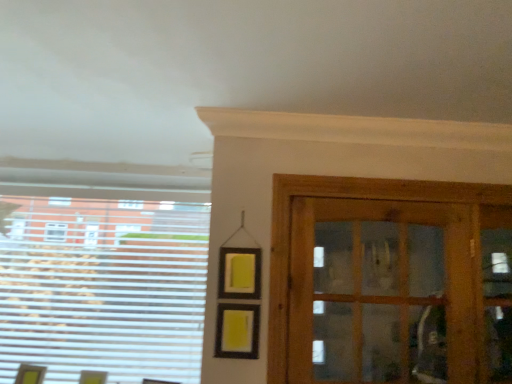
Question: Is white plastic blinds at left positioned far away from wooden cabinet at right?

Choices:
 (A) yes
 (B) no

Answer: (A)

Question: Considering the relative sizes of white plastic blinds at left and wooden cabinet at right in the image provided, is white plastic blinds at left smaller than wooden cabinet at right?

Choices:
 (A) no
 (B) yes

Answer: (B)

Question: Is white plastic blinds at left further to camera compared to wooden cabinet at right?

Choices:
 (A) no
 (B) yes

Answer: (B)

Question: From a real-world perspective, is white plastic blinds at left positioned under wooden cabinet at right based on gravity?

Choices:
 (A) yes
 (B) no

Answer: (A)

Question: Could you tell me if white plastic blinds at left is facing wooden cabinet at right?

Choices:
 (A) yes
 (B) no

Answer: (B)

Question: Is white plastic blinds at left wider than wooden cabinet at right?

Choices:
 (A) yes
 (B) no

Answer: (B)

Question: From the image's perspective, would you say wooden cabinet at right is shown under white plastic blinds at left?

Choices:
 (A) no
 (B) yes

Answer: (A)

Question: Does wooden cabinet at right contain white plastic blinds at left?

Choices:
 (A) yes
 (B) no

Answer: (B)

Question: From a real-world perspective, is wooden cabinet at right physically above white plastic blinds at left?

Choices:
 (A) no
 (B) yes

Answer: (B)

Question: Can you confirm if wooden cabinet at right is wider than white plastic blinds at left?

Choices:
 (A) yes
 (B) no

Answer: (A)

Question: Can you confirm if wooden cabinet at right is smaller than white plastic blinds at left?

Choices:
 (A) no
 (B) yes

Answer: (A)

Question: Can you see wooden cabinet at right touching white plastic blinds at left?

Choices:
 (A) no
 (B) yes

Answer: (A)

Question: Considering the positions of wooden cabinet at right and white plastic blinds at left in the image, is wooden cabinet at right taller or shorter than white plastic blinds at left?

Choices:
 (A) tall
 (B) short

Answer: (B)